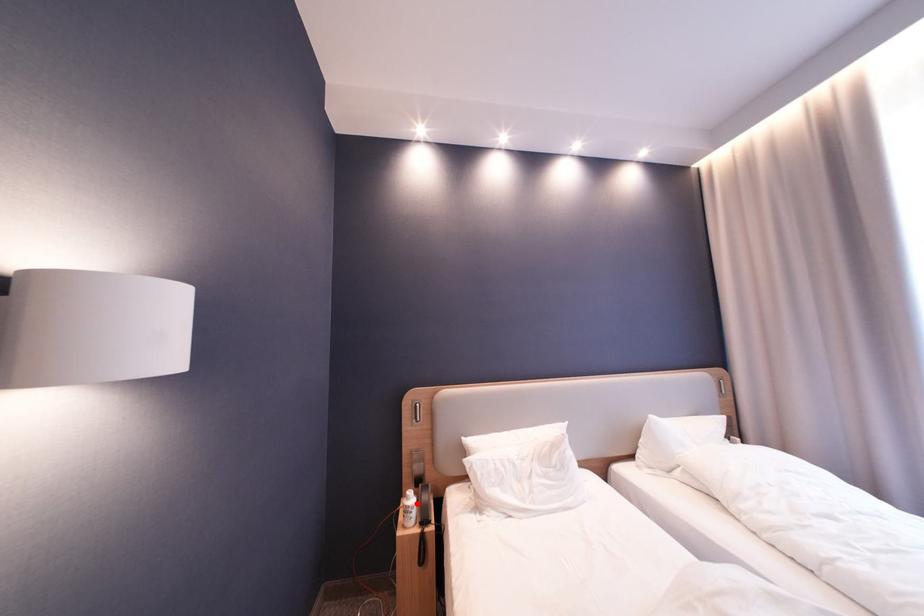
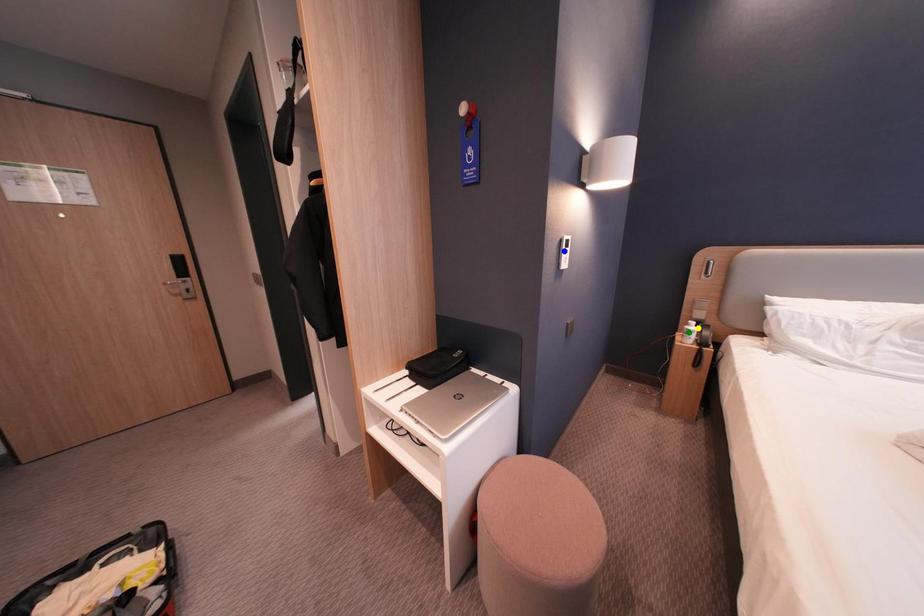
Question: I am providing you with two images of the same scene from different viewpoints. A red point is marked on the first image. You are given multiple points on the second image. In image 2, which mark is for the same physical point as the one in image 1?

Choices:
 (A) green point
 (B) yellow point
 (C) blue point

Answer: (B)